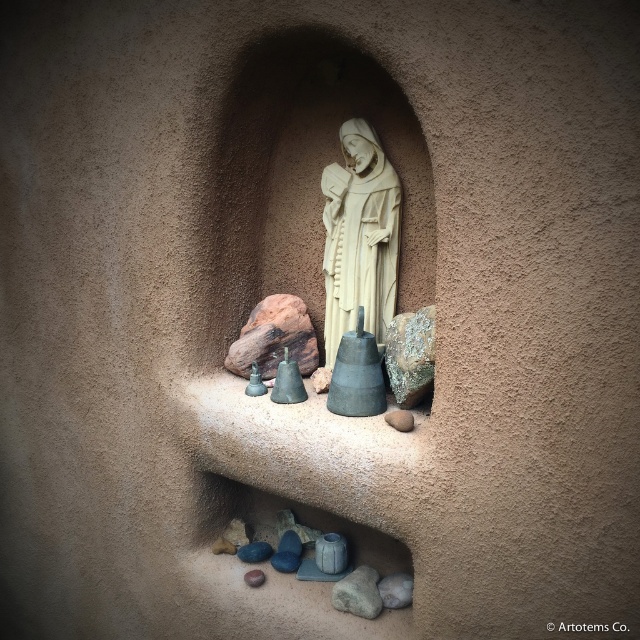
Can you confirm if white stone statue at center is bigger than gray rough stone at center?

Yes, white stone statue at center is bigger than gray rough stone at center.

Does white stone statue at center have a lesser width compared to gray rough stone at center?

No.

Is point (355, 300) positioned before point (369, 593)?

No, (355, 300) is behind (369, 593).

Locate an element on the screen. The image size is (640, 640). white stone statue at center is located at coordinates (358, 236).

Between gray rough stone at center and smooth gray rock at center, which one has more height?

With more height is gray rough stone at center.

Which is behind, point (376, 602) or point (406, 419)?

Positioned behind is point (376, 602).

This screenshot has height=640, width=640. Identify the location of gray rough stone at center. (356, 593).

Based on the photo, is white stone statue at center taller than smooth gray rock at center?

Yes, white stone statue at center is taller than smooth gray rock at center.

Between point (372, 252) and point (401, 429), which one is positioned behind?

The point (372, 252) is more distant.

Locate an element on the screen. white stone statue at center is located at coordinates (358, 236).